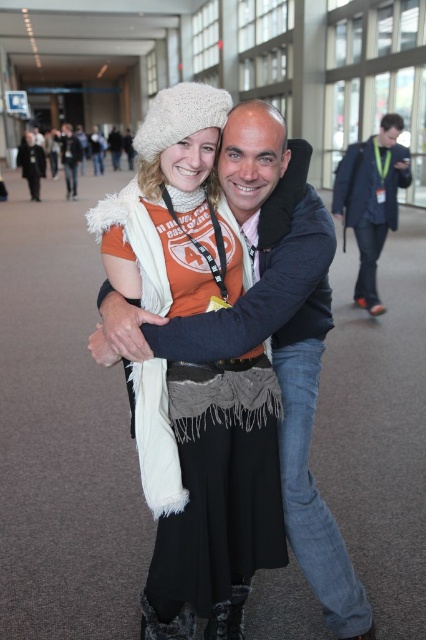
Question: Is the position of dark blue suit at center less distant than that of matte black jacket at center?

Choices:
 (A) no
 (B) yes

Answer: (B)

Question: Does white fuzzy hat at upper center have a greater width compared to white woolen hat at upper center?

Choices:
 (A) yes
 (B) no

Answer: (B)

Question: Which point appears closest to the camera in this image?

Choices:
 (A) (26, 138)
 (B) (340, 204)

Answer: (B)

Question: Which of the following is the farthest from the observer?

Choices:
 (A) white fuzzy hat at upper center
 (B) white woolen hat at upper center
 (C) matte black jacket at center
 (D) dark blue suit at center

Answer: (C)

Question: Is dark blue suit at center wider than matte black jacket at center?

Choices:
 (A) yes
 (B) no

Answer: (B)

Question: Which point appears farthest from the camera in this image?

Choices:
 (A) (224, 93)
 (B) (63, 160)
 (C) (379, 314)

Answer: (B)